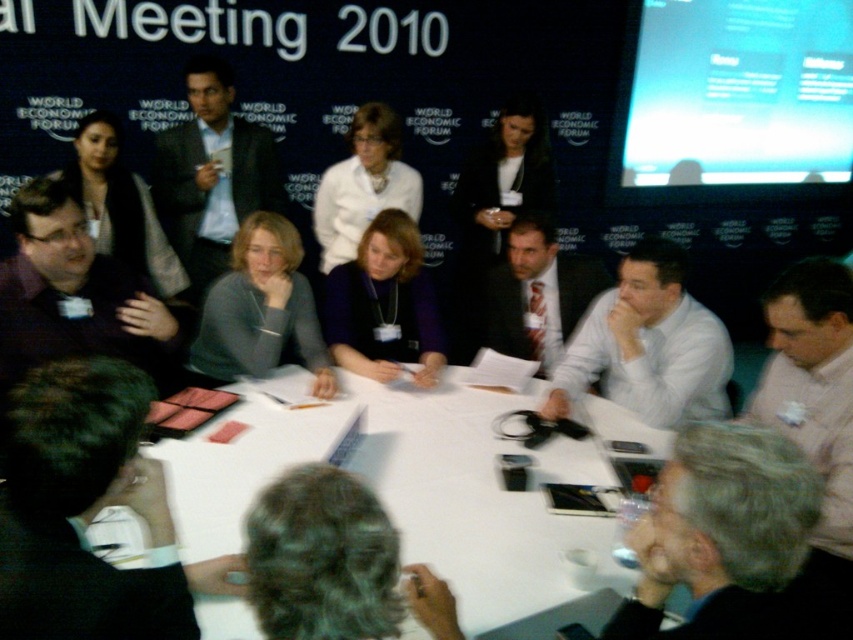
You are attending the World Economic Forum and notice two attendees in the foreground. One is wearing a purple matte jacket at center, and the other has a matte gray sweater at upper left. From your perspective, which clothing item is positioned to the right of the other?

The purple matte jacket at center is to the right of the matte gray sweater at upper left.

You are sitting at the table in the meeting. There are two points marked on the table. One is at coordinates point [428,381] and the other at point [155,221]. If you want to reach the point that is closer to you, which coordinate should you move towards?

Point [155,221] is closer to you because it is behind point [428,381] according to the spatial description.